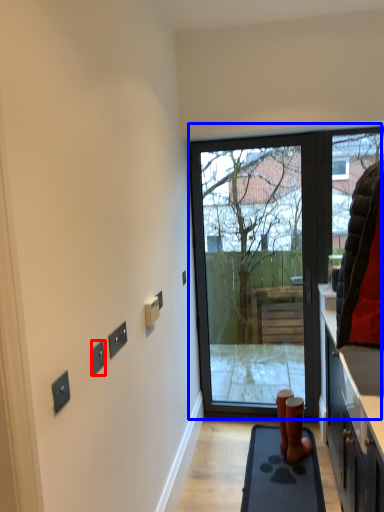
Question: Which of the following is the closest to the observer, electric outlet (highlighted by a red box) or door (highlighted by a blue box)?

Choices:
 (A) electric outlet
 (B) door

Answer: (A)